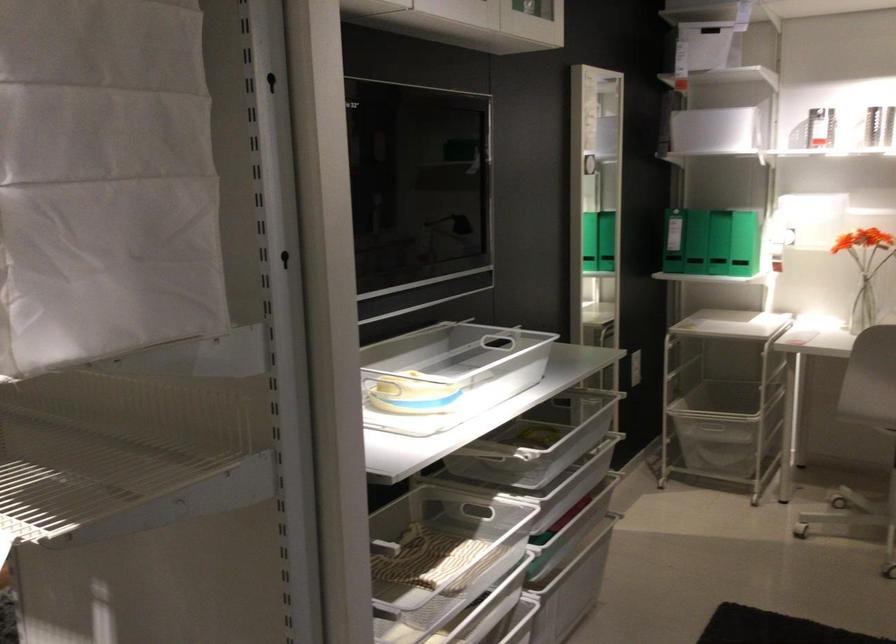
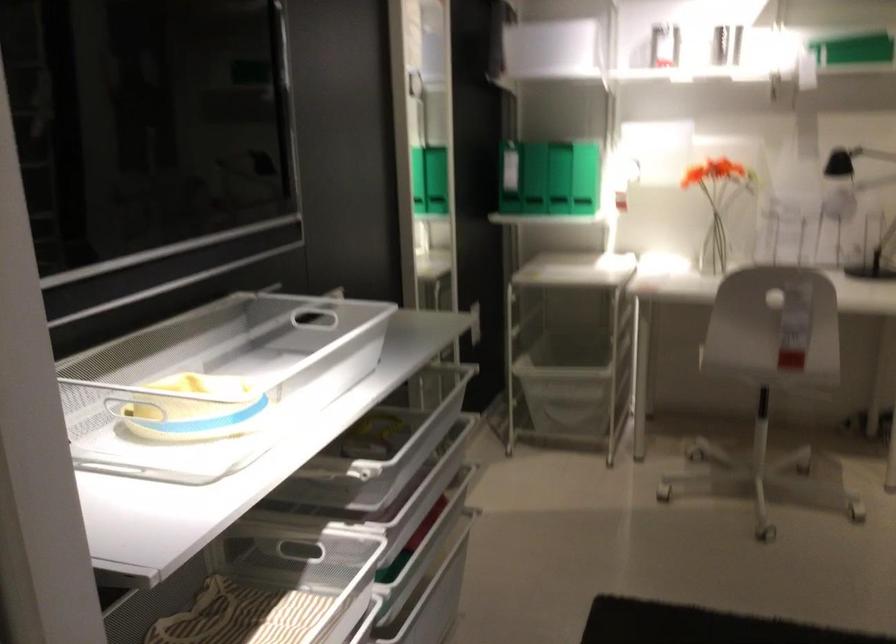
Find the pixel in the second image that matches [690,231] in the first image.

(511, 174)